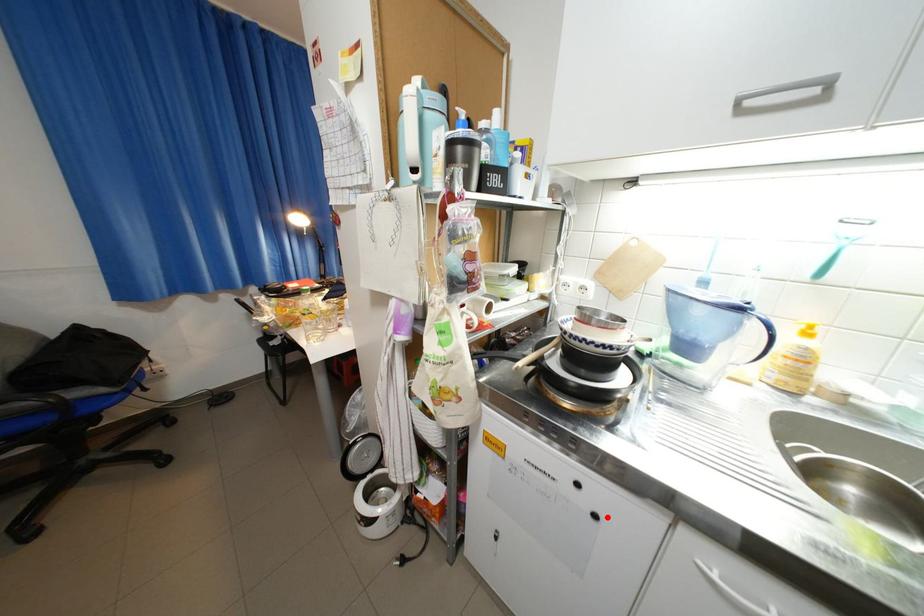
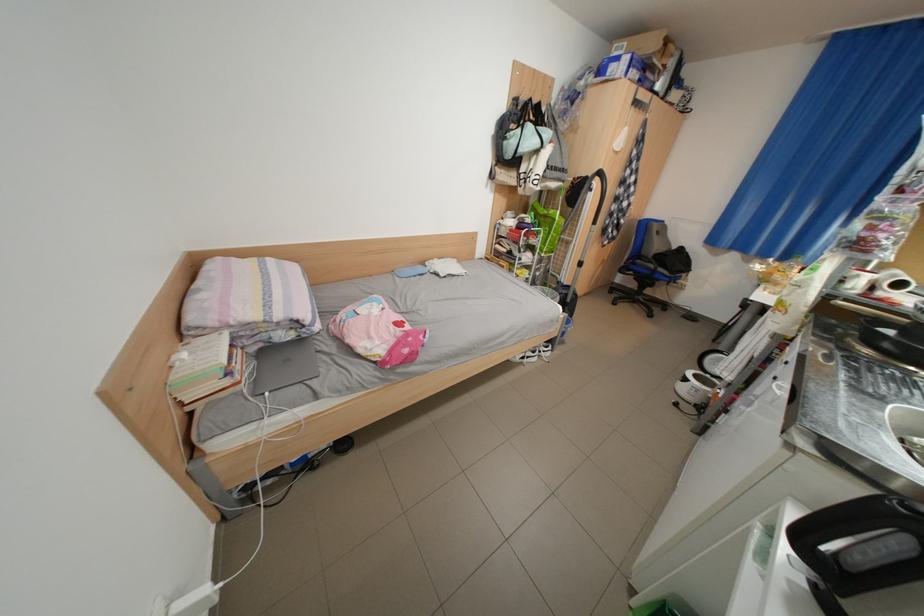
In the second image, find the point that corresponds to the highlighted location in the first image.

(786, 379)